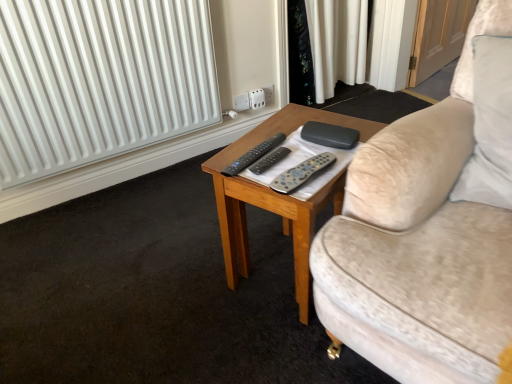
Question: Is black matte remote control at center, which appears as the first remote control when viewed from the left, a part of white plastic socket at upper center?

Choices:
 (A) no
 (B) yes

Answer: (A)

Question: Does white plastic socket at upper center appear on the left side of black matte remote control at center, the third remote control positioned from the right?

Choices:
 (A) no
 (B) yes

Answer: (A)

Question: Can you confirm if white plastic socket at upper center is shorter than black matte remote control at center, which appears as the first remote control when viewed from the left?

Choices:
 (A) no
 (B) yes

Answer: (A)

Question: Does white plastic socket at upper center have a greater height compared to black matte remote control at center, which appears as the first remote control when viewed from the left?

Choices:
 (A) yes
 (B) no

Answer: (A)

Question: Does white plastic socket at upper center have a smaller size compared to black matte remote control at center, the third remote control positioned from the right?

Choices:
 (A) yes
 (B) no

Answer: (B)

Question: From a real-world perspective, is white plastic socket at upper center beneath black matte remote control at center, which appears as the first remote control when viewed from the left?

Choices:
 (A) no
 (B) yes

Answer: (B)

Question: Does black matte remote control at center, which appears as the first remote control when viewed from the left, have a lesser height compared to white plastic socket at upper center?

Choices:
 (A) no
 (B) yes

Answer: (B)

Question: From a real-world perspective, is black matte remote control at center, the third remote control positioned from the right, physically above white plastic socket at upper center?

Choices:
 (A) no
 (B) yes

Answer: (B)

Question: From the image's perspective, is black matte remote control at center, which appears as the first remote control when viewed from the left, on white plastic socket at upper center?

Choices:
 (A) yes
 (B) no

Answer: (B)

Question: Considering the relative sizes of black matte remote control at center, the third remote control positioned from the right, and white plastic socket at upper center in the image provided, is black matte remote control at center, the third remote control positioned from the right, taller than white plastic socket at upper center?

Choices:
 (A) no
 (B) yes

Answer: (A)

Question: Can you confirm if black matte remote control at center, the third remote control positioned from the right, is positioned to the left of white plastic socket at upper center?

Choices:
 (A) yes
 (B) no

Answer: (A)

Question: Does black matte remote control at center, which appears as the first remote control when viewed from the left, appear on the right side of white plastic socket at upper center?

Choices:
 (A) yes
 (B) no

Answer: (B)

Question: Can you confirm if gray matte remote control at center, the 1th remote control viewed from the right, is wider than white plastic socket at upper center?

Choices:
 (A) no
 (B) yes

Answer: (B)